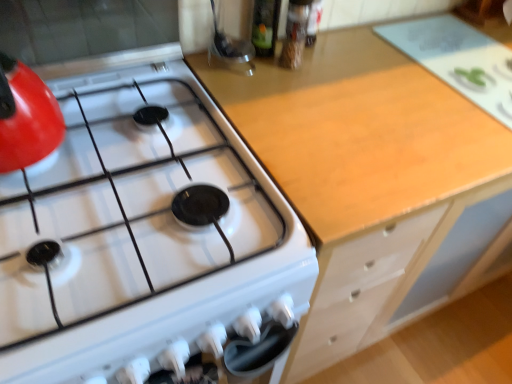
Question: Does white glossy gas stove at upper left have a lesser width compared to light wood cabinet at center?

Choices:
 (A) no
 (B) yes

Answer: (A)

Question: Considering the relative positions of white glossy gas stove at upper left and light wood cabinet at center in the image provided, is white glossy gas stove at upper left to the right of light wood cabinet at center from the viewer's perspective?

Choices:
 (A) no
 (B) yes

Answer: (A)

Question: Considering the relative positions of white glossy gas stove at upper left and light wood cabinet at center in the image provided, is white glossy gas stove at upper left to the left of light wood cabinet at center from the viewer's perspective?

Choices:
 (A) yes
 (B) no

Answer: (A)

Question: Does white glossy gas stove at upper left have a smaller size compared to light wood cabinet at center?

Choices:
 (A) yes
 (B) no

Answer: (A)

Question: Is white glossy gas stove at upper left completely or partially outside of light wood cabinet at center?

Choices:
 (A) yes
 (B) no

Answer: (A)

Question: From a real-world perspective, is white glossy gas stove at upper left over light wood cabinet at center?

Choices:
 (A) no
 (B) yes

Answer: (B)

Question: Can you confirm if light wood cabinet at center is wider than white glossy gas stove at upper left?

Choices:
 (A) no
 (B) yes

Answer: (A)

Question: Does light wood cabinet at center have a larger size compared to white glossy gas stove at upper left?

Choices:
 (A) no
 (B) yes

Answer: (B)

Question: Is light wood cabinet at center next to white glossy gas stove at upper left?

Choices:
 (A) no
 (B) yes

Answer: (A)

Question: Is light wood cabinet at center not within white glossy gas stove at upper left?

Choices:
 (A) no
 (B) yes

Answer: (B)

Question: Does light wood cabinet at center appear on the left side of white glossy gas stove at upper left?

Choices:
 (A) yes
 (B) no

Answer: (B)

Question: Is light wood cabinet at center positioned far away from white glossy gas stove at upper left?

Choices:
 (A) yes
 (B) no

Answer: (B)

Question: Is light wood cabinet at center to the left or to the right of white glossy gas stove at upper left in the image?

Choices:
 (A) right
 (B) left

Answer: (A)